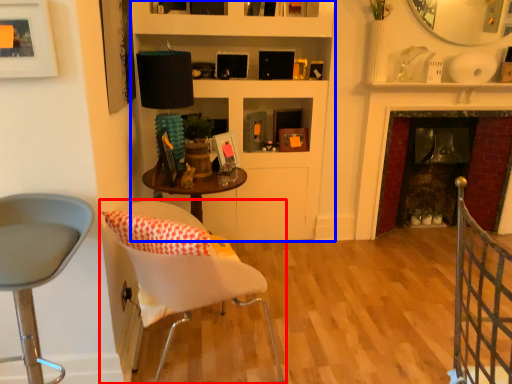
Question: Which object appears closest to the camera in this image, chair (highlighted by a red box) or bookshelf (highlighted by a blue box)?

Choices:
 (A) chair
 (B) bookshelf

Answer: (A)